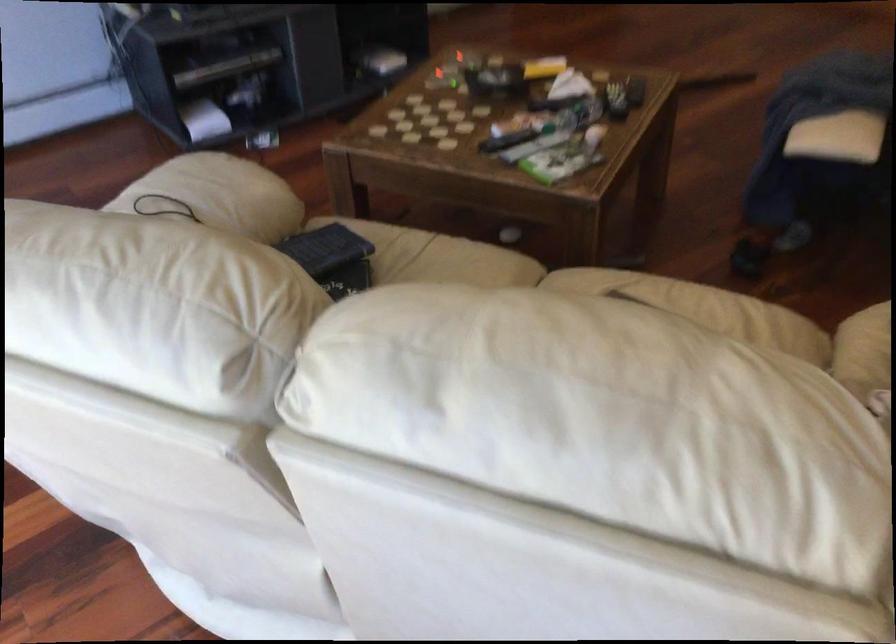
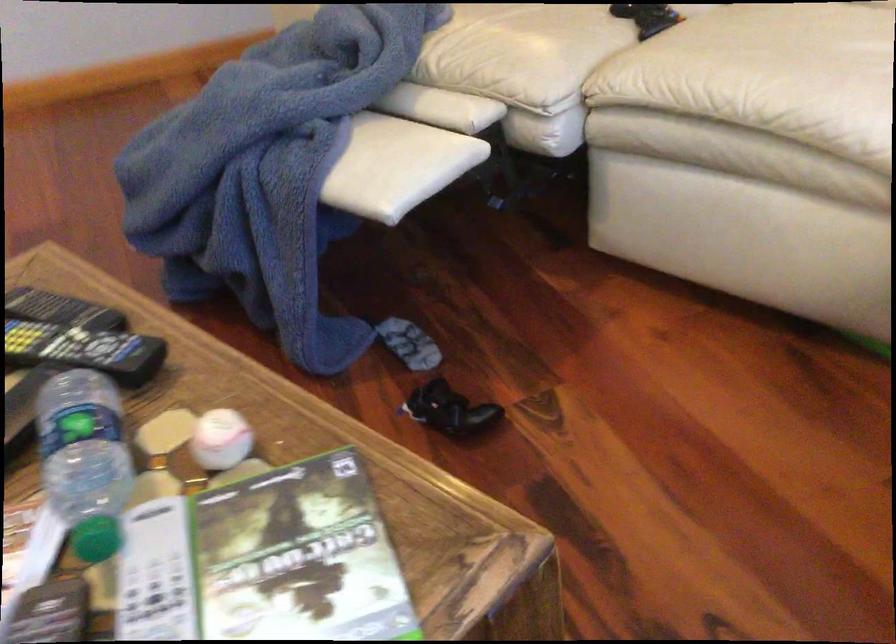
Locate, in the second image, the point that corresponds to point 549,149 in the first image.

(298, 556)